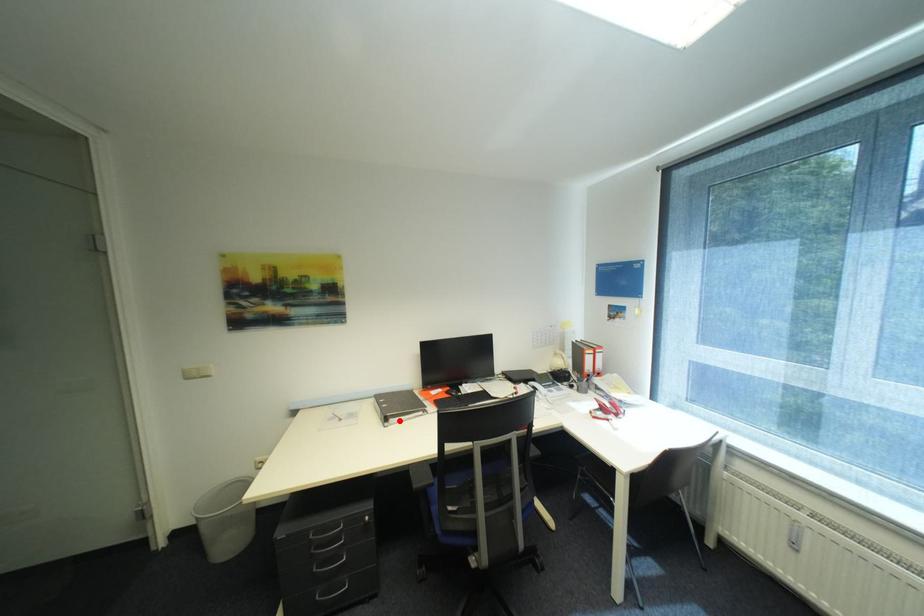
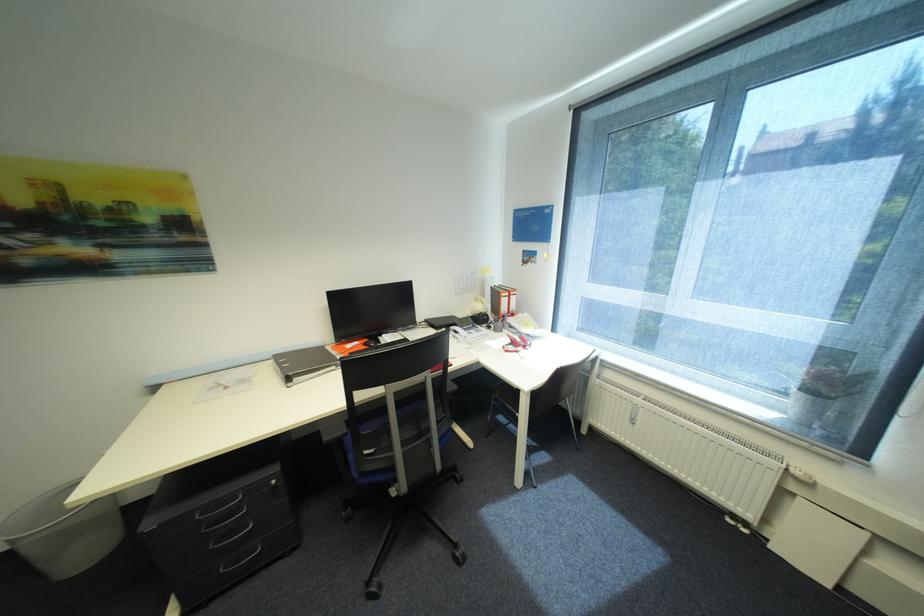
In the second image, find the point that corresponds to the highlighted location in the first image.

(304, 379)